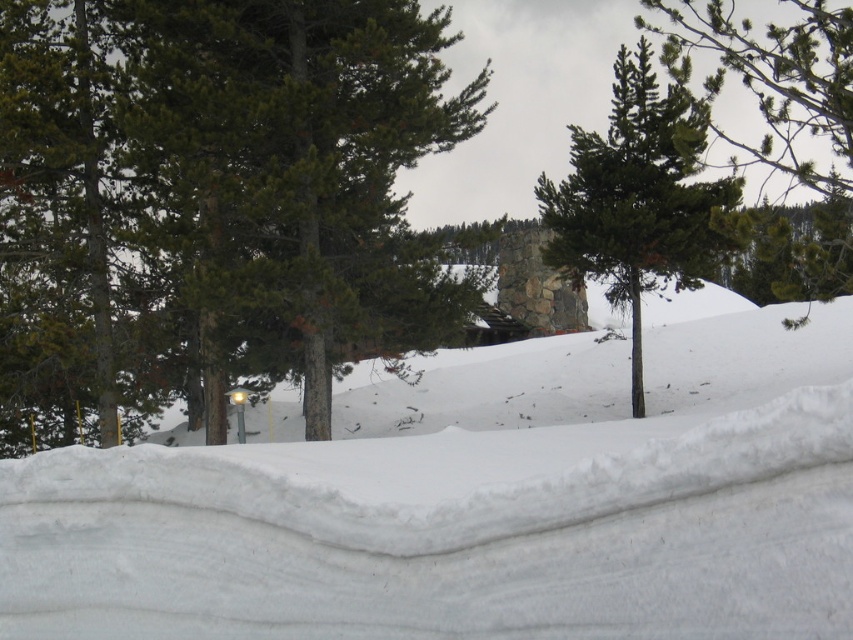
Question: Which of the following is the farthest from the observer?

Choices:
 (A) (228, 122)
 (B) (326, 547)
 (C) (831, 296)

Answer: (A)

Question: Can you confirm if white snow at center is positioned below green matte tree at left?

Choices:
 (A) yes
 (B) no

Answer: (A)

Question: Is white snow at center to the left of green matte tree at left from the viewer's perspective?

Choices:
 (A) no
 (B) yes

Answer: (A)

Question: Which object is farther from the camera taking this photo?

Choices:
 (A) green needle-like at upper right
 (B) white snow at center

Answer: (A)

Question: Is green matte tree at left smaller than green needle-like at upper right?

Choices:
 (A) no
 (B) yes

Answer: (B)

Question: Which of the following is the farthest from the observer?

Choices:
 (A) (734, 36)
 (B) (648, 128)
 (C) (556, 618)
 (D) (369, 317)

Answer: (A)